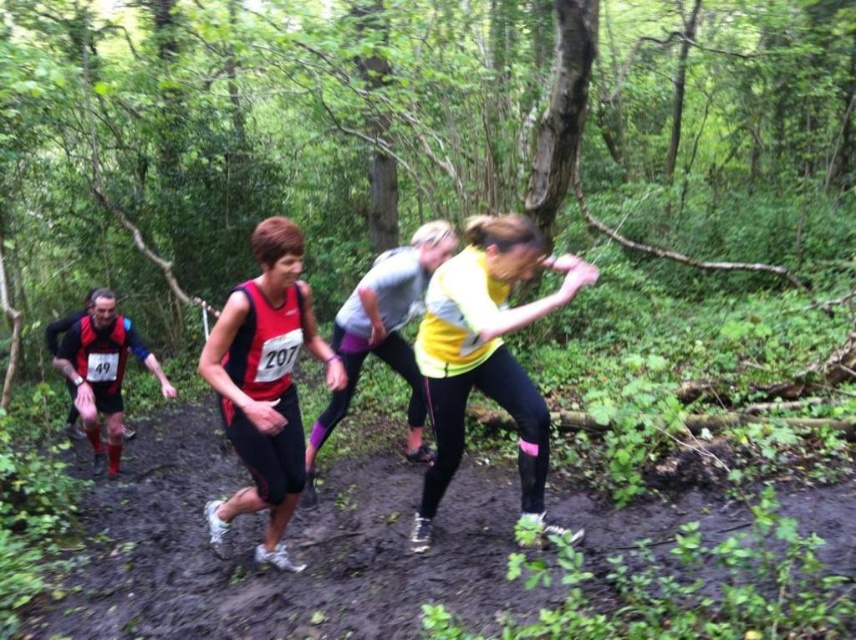
Question: Considering the real-world distances, which object is farthest from the yellow fabric running suit at center?

Choices:
 (A) matte black running suit at left
 (B) matte red tank top at center
 (C) yellow matte shirt at center

Answer: (A)

Question: Estimate the real-world distances between objects in this image. Which object is closer to the matte red tank top at center?

Choices:
 (A) yellow matte shirt at center
 (B) yellow fabric running suit at center
 (C) matte black running suit at left

Answer: (A)

Question: Can you confirm if yellow matte shirt at center is positioned to the left of matte black running suit at left?

Choices:
 (A) yes
 (B) no

Answer: (B)

Question: Can you confirm if yellow matte shirt at center is wider than matte red tank top at center?

Choices:
 (A) yes
 (B) no

Answer: (B)

Question: Which object is the farthest from the matte black running suit at left?

Choices:
 (A) yellow matte shirt at center
 (B) matte red tank top at center

Answer: (A)

Question: From the image, what is the correct spatial relationship of yellow matte shirt at center in relation to yellow fabric running suit at center?

Choices:
 (A) right
 (B) left

Answer: (A)